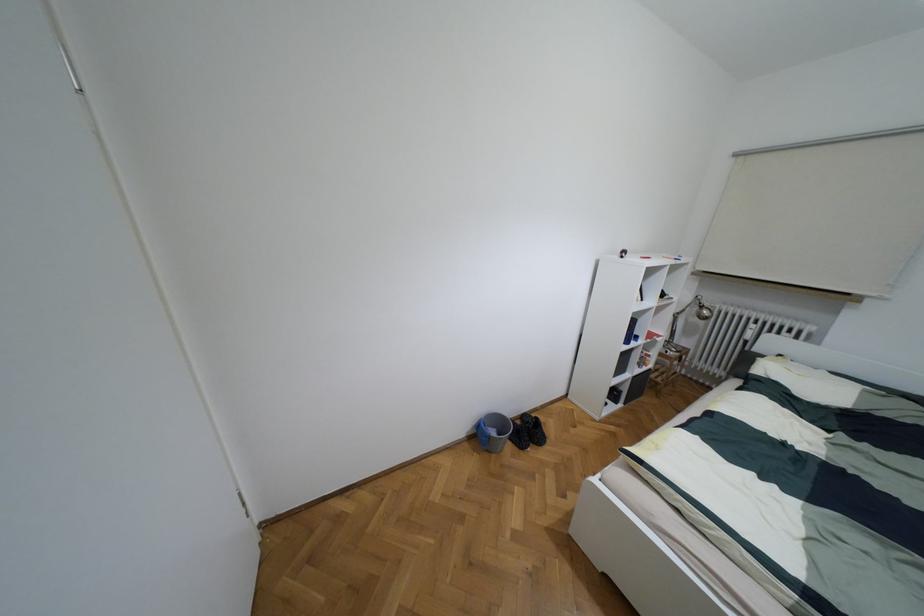
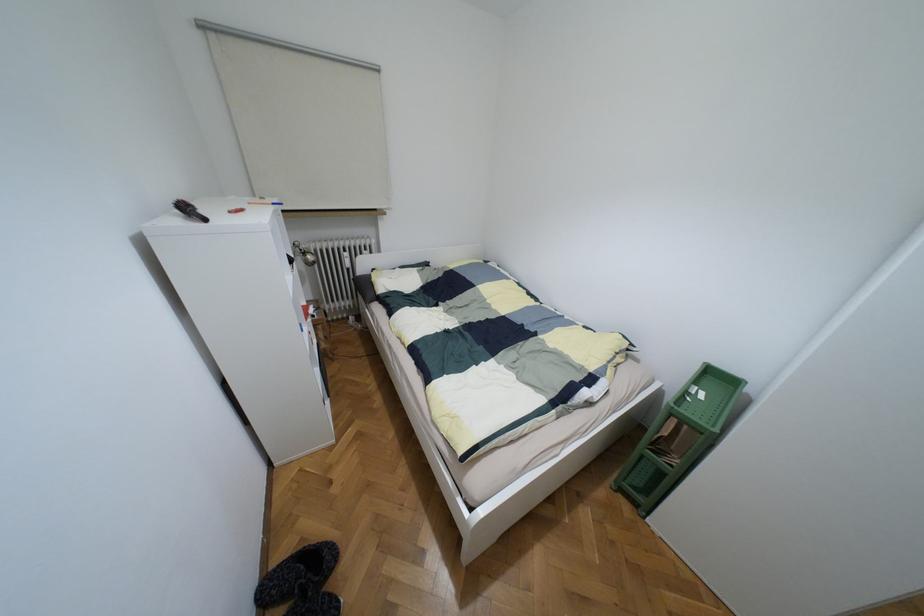
The images are taken continuously from a first-person perspective. In which direction is your viewpoint rotating?

The rotation direction of the camera is right-down.